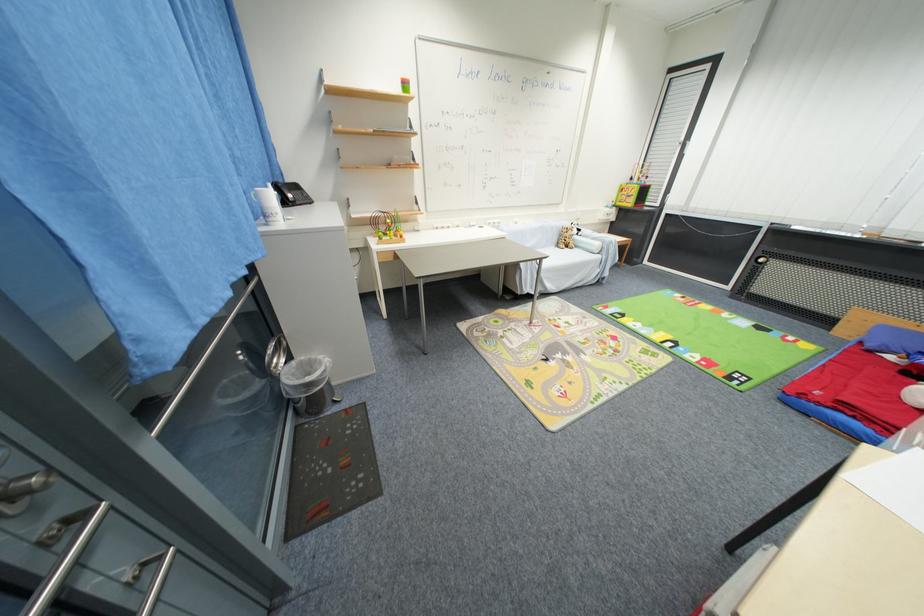
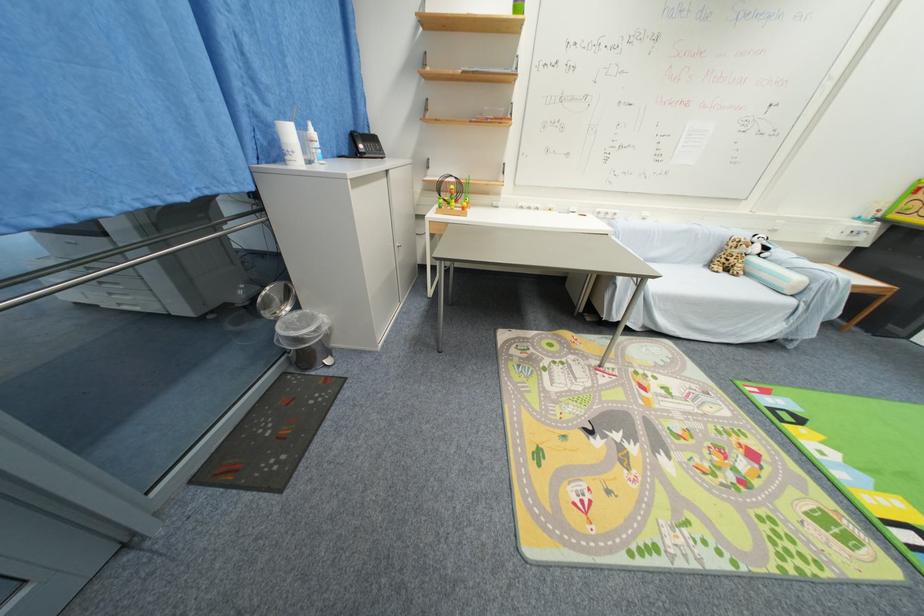
The point at (295, 360) is marked in the first image. Where is the corresponding point in the second image?

(301, 309)